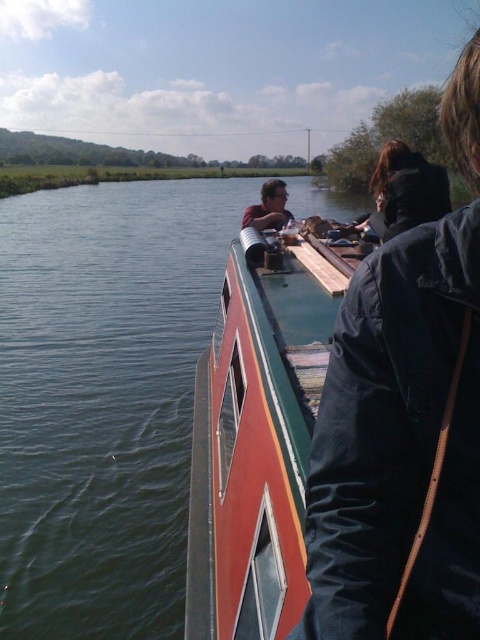
Consider the image. How distant is green smooth water at upper left from dark blue jacket at upper right?

green smooth water at upper left and dark blue jacket at upper right are 21.50 meters apart.

Can you confirm if green smooth water at upper left is bigger than dark blue jacket at upper right?

Yes, green smooth water at upper left is bigger than dark blue jacket at upper right.

Between point (119, 538) and point (471, 138), which one is positioned behind?

The point (119, 538) is more distant.

You are a GUI agent. You are given a task and a screenshot of the screen. Output one action in this format:
    pyautogui.click(x=<x>, y=<y>)
    Task: Click on the green smooth water at upper left
    
    Given the screenshot: What is the action you would take?
    pyautogui.click(x=101, y=397)

Can you confirm if polished wood boat at center is thinner than matte black jacket at center?

In fact, polished wood boat at center might be wider than matte black jacket at center.

Between polished wood boat at center and matte black jacket at center, which one has more height?

polished wood boat at center

Is point (282, 502) behind point (265, 184)?

That is False.

Where is `polished wood boat at center`? The height and width of the screenshot is (640, 480). polished wood boat at center is located at coordinates (257, 436).

Consider the image. Does green smooth water at upper left appear under matte black jacket at center?

Actually, green smooth water at upper left is above matte black jacket at center.

Which is above, green smooth water at upper left or matte black jacket at center?

green smooth water at upper left

Image resolution: width=480 pixels, height=640 pixels. I want to click on green smooth water at upper left, so pos(101,397).